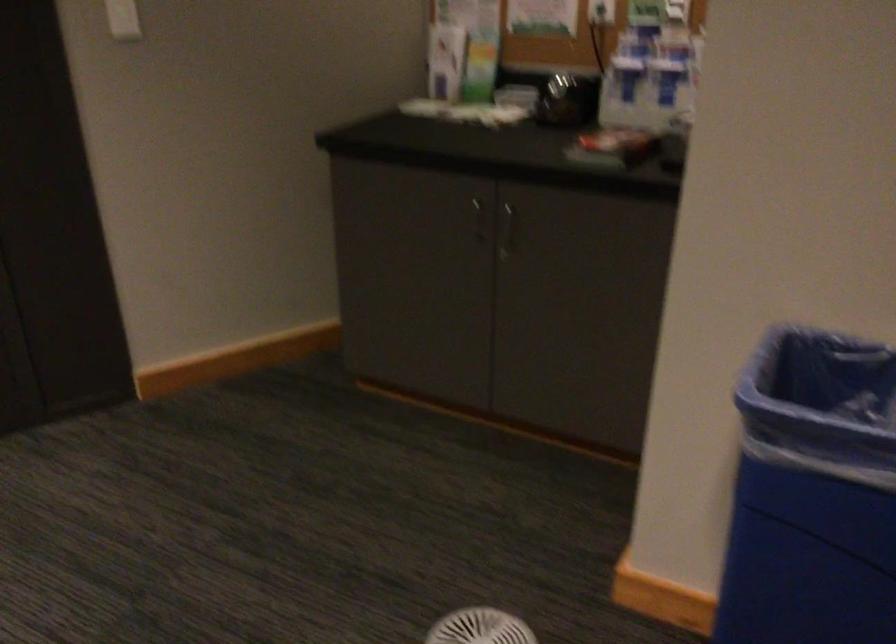
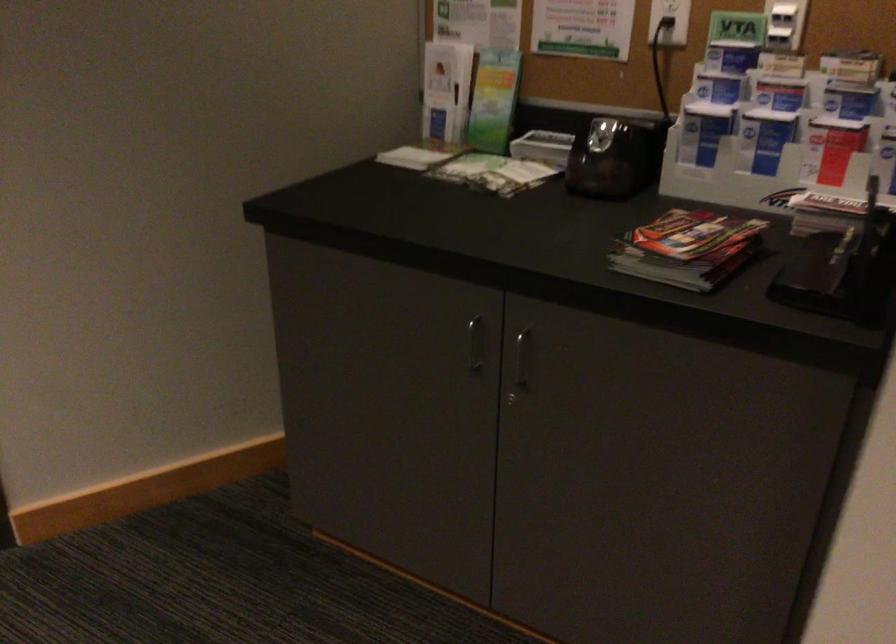
Locate, in the second image, the point that corresponds to pixel 666 79 in the first image.

(764, 138)